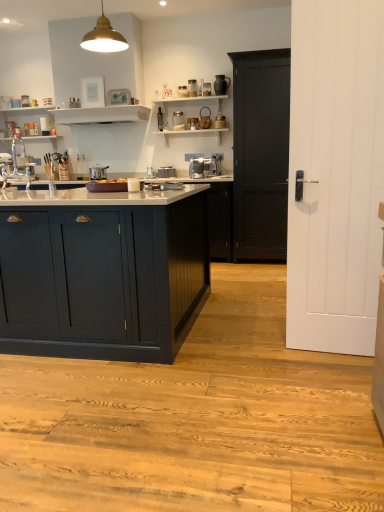
Identify the location of metallic gold pendant light at upper center. (104, 37).

Locate an element on the screen. This screenshot has height=512, width=384. white smooth door at right is located at coordinates coord(335,175).

Describe the element at coordinates (260, 154) in the screenshot. Image resolution: width=384 pixels, height=512 pixels. I see `matte black cabinet at center, which appears as the 2th cabinetry when viewed from the front` at that location.

Image resolution: width=384 pixels, height=512 pixels. I want to click on metallic gold pendant light at upper center, so 104,37.

Is white smooth door at right positioned beyond the bounds of white glossy shelf at upper center, which ranks as the second shelf in left-to-right order?

Absolutely, white smooth door at right is external to white glossy shelf at upper center, which ranks as the second shelf in left-to-right order.

Could you tell me if white smooth door at right is facing white glossy shelf at upper center, arranged as the 1th shelf when viewed from the right?

No, white smooth door at right does not turn towards white glossy shelf at upper center, arranged as the 1th shelf when viewed from the right.

Between matte dark blue cabinet at center-left, which is the second cabinetry from back to front, and white smooth door at right, which one has larger size?

Bigger between the two is matte dark blue cabinet at center-left, which is the second cabinetry from back to front.

Who is shorter, matte dark blue cabinet at center-left, the 2th cabinetry positioned from the right, or white smooth door at right?

Standing shorter between the two is matte dark blue cabinet at center-left, the 2th cabinetry positioned from the right.

From the image's perspective, which one is positioned lower, matte dark blue cabinet at center-left, the 2th cabinetry positioned from the right, or white smooth door at right?

matte dark blue cabinet at center-left, the 2th cabinetry positioned from the right.

Can you confirm if matte dark blue cabinet at center-left, which is the second cabinetry from back to front, is wider than white smooth door at right?

Yes.

Between satin silver toaster at center, placed as the 2th appliance when sorted from left to right, and satin silver pot at center, which ranks as the 2th appliance in right-to-left order, which one has larger size?

satin silver pot at center, which ranks as the 2th appliance in right-to-left order.

From a real-world perspective, is satin silver toaster at center, which appears as the 1th appliance when viewed from the right, below satin silver pot at center, which ranks as the 2th appliance in right-to-left order?

Yes, from a real-world perspective, satin silver toaster at center, which appears as the 1th appliance when viewed from the right, is below satin silver pot at center, which ranks as the 2th appliance in right-to-left order.

Between satin silver toaster at center, placed as the 2th appliance when sorted from left to right, and satin silver pot at center, which ranks as the 2th appliance in right-to-left order, which one has less height?

satin silver toaster at center, placed as the 2th appliance when sorted from left to right.

From the picture: Which object is wider, satin silver toaster at center, which appears as the 1th appliance when viewed from the right, or satin silver pot at center, which appears as the first appliance when viewed from the left?

Wider between the two is satin silver pot at center, which appears as the first appliance when viewed from the left.

Consider the image. Is satin silver toaster at center, placed as the 2th appliance when sorted from left to right, located within white glossy sink at left?

No, white glossy sink at left does not contain satin silver toaster at center, placed as the 2th appliance when sorted from left to right.

Can you confirm if white glossy sink at left is thinner than satin silver toaster at center, which appears as the 1th appliance when viewed from the right?

Incorrect, the width of white glossy sink at left is not less than that of satin silver toaster at center, which appears as the 1th appliance when viewed from the right.

Is white glossy sink at left directly adjacent to satin silver toaster at center, which appears as the 1th appliance when viewed from the right?

No, white glossy sink at left is not in contact with satin silver toaster at center, which appears as the 1th appliance when viewed from the right.

From the image's perspective, is white glossy shelf at upper center, arranged as the 1th shelf when viewed from the right, over matte dark blue cabinet at center-left, acting as the first cabinetry starting from the front?

Yes.

Is white glossy shelf at upper center, arranged as the 1th shelf when viewed from the right, facing towards matte dark blue cabinet at center-left, the 2th cabinetry positioned from the right?

No, white glossy shelf at upper center, arranged as the 1th shelf when viewed from the right, is not facing towards matte dark blue cabinet at center-left, the 2th cabinetry positioned from the right.

The height and width of the screenshot is (512, 384). I want to click on the 2nd cabinetry below the white ceramic mugs at upper left, the first shelf in the left-to-right sequence (from the image's perspective), so click(102, 278).

Considering the positions of point (104, 324) and point (33, 106), is point (104, 324) closer or farther from the camera than point (33, 106)?

Point (104, 324) is positioned closer to the camera compared to point (33, 106).

Considering the sizes of matte dark blue cabinet at center-left, which appears as the 1th cabinetry when viewed from the left, and white ceramic mugs at upper left, the first shelf in the left-to-right sequence, in the image, is matte dark blue cabinet at center-left, which appears as the 1th cabinetry when viewed from the left, bigger or smaller than white ceramic mugs at upper left, the first shelf in the left-to-right sequence,?

In the image, matte dark blue cabinet at center-left, which appears as the 1th cabinetry when viewed from the left, appears to be larger than white ceramic mugs at upper left, the first shelf in the left-to-right sequence.

Between matte dark blue cabinet at center-left, the 2th cabinetry positioned from the right, and white ceramic mugs at upper left, acting as the second shelf starting from the right, which one has less height?

Standing shorter between the two is white ceramic mugs at upper left, acting as the second shelf starting from the right.

From the image's perspective, is white glossy shelf at upper center, arranged as the 1th shelf when viewed from the right, on metallic gold pendant light at upper center?

Yes, from the image's perspective, white glossy shelf at upper center, arranged as the 1th shelf when viewed from the right, is above metallic gold pendant light at upper center.

Find the location of a particular element. the 1st shelf to the left of the metallic gold pendant light at upper center, starting your count from the anchor is located at coordinates (101, 115).

Which is correct: white glossy shelf at upper center, arranged as the 1th shelf when viewed from the right, is inside metallic gold pendant light at upper center, or outside of it?

white glossy shelf at upper center, arranged as the 1th shelf when viewed from the right, lies outside metallic gold pendant light at upper center.

In the image, there is a white glossy shelf at upper center, arranged as the 1th shelf when viewed from the right. At what (x,y) coordinates should I click in order to perform the action: click on door below it (from the image's perspective). Please return your answer as a coordinate pair (x, y). Looking at the image, I should click on click(335, 175).

Find the location of `door lying on the right of matte dark blue cabinet at center-left, the 2th cabinetry positioned from the right`. door lying on the right of matte dark blue cabinet at center-left, the 2th cabinetry positioned from the right is located at coordinates (335, 175).

When comparing their distances from white glossy sink at left, does satin silver coffee machine at center or white smooth door at right seem further?

white smooth door at right lies further to white glossy sink at left than the other object.

Looking at the image, which one is located further to white glossy sink at left, white glossy shelf at upper center, which ranks as the second shelf in left-to-right order, or matte black cabinet at center, which appears as the 2th cabinetry when viewed from the front?

matte black cabinet at center, which appears as the 2th cabinetry when viewed from the front.

Based on the photo, when comparing their distances from matte dark blue cabinet at center-left, which is the second cabinetry from back to front, does white smooth door at right or satin silver pot at center, which ranks as the 2th appliance in right-to-left order, seem further?

The object further to matte dark blue cabinet at center-left, which is the second cabinetry from back to front, is satin silver pot at center, which ranks as the 2th appliance in right-to-left order.

Looking at the image, which one is located further to satin silver coffee machine at center, matte dark blue cabinet at center-left, which appears as the 1th cabinetry when viewed from the left, or white ceramic mugs at upper left, acting as the second shelf starting from the right?

Among the two, white ceramic mugs at upper left, acting as the second shelf starting from the right, is located further to satin silver coffee machine at center.

Considering their positions, is white smooth door at right positioned further to satin silver toaster at center, placed as the 2th appliance when sorted from left to right, than white glossy sink at left?

Among the two, white smooth door at right is located further to satin silver toaster at center, placed as the 2th appliance when sorted from left to right.

Estimate the real-world distances between objects in this image. Which object is further from matte black cabinet at center, which ranks as the 2th cabinetry in left-to-right order, satin silver toaster at center, which appears as the 1th appliance when viewed from the right, or satin silver coffee machine at center?

satin silver toaster at center, which appears as the 1th appliance when viewed from the right, is positioned further to the anchor matte black cabinet at center, which ranks as the 2th cabinetry in left-to-right order.

Based on their spatial positions, is matte black cabinet at center, which appears as the 2th cabinetry when viewed from the front, or satin silver toaster at center, placed as the 2th appliance when sorted from left to right, closer to white glossy sink at left?

satin silver toaster at center, placed as the 2th appliance when sorted from left to right, is closer to white glossy sink at left.

When comparing their distances from satin silver toaster at center, which appears as the 1th appliance when viewed from the right, does white glossy shelf at upper center, which ranks as the second shelf in left-to-right order, or white smooth door at right seem further?

Among the two, white smooth door at right is located further to satin silver toaster at center, which appears as the 1th appliance when viewed from the right.

Image resolution: width=384 pixels, height=512 pixels. I want to click on light fixture located between matte dark blue cabinet at center-left, which appears as the 1th cabinetry when viewed from the left, and satin silver toaster at center, placed as the 2th appliance when sorted from left to right, in the depth direction, so click(x=104, y=37).

Where is `coffee machine between metallic gold pendant light at upper center and satin silver toaster at center, which appears as the 1th appliance when viewed from the right, along the z-axis`? This screenshot has height=512, width=384. coffee machine between metallic gold pendant light at upper center and satin silver toaster at center, which appears as the 1th appliance when viewed from the right, along the z-axis is located at coordinates (203, 167).

This screenshot has height=512, width=384. I want to click on cabinetry between matte dark blue cabinet at center-left, which appears as the 1th cabinetry when viewed from the left, and white glossy shelf at upper center, which ranks as the second shelf in left-to-right order, along the z-axis, so click(x=260, y=154).

Find the location of a particular element. Image resolution: width=384 pixels, height=512 pixels. coffee machine located between satin silver pot at center, which appears as the first appliance when viewed from the left, and matte black cabinet at center, marked as the first cabinetry in a right-to-left arrangement, in the left-right direction is located at coordinates (203, 167).